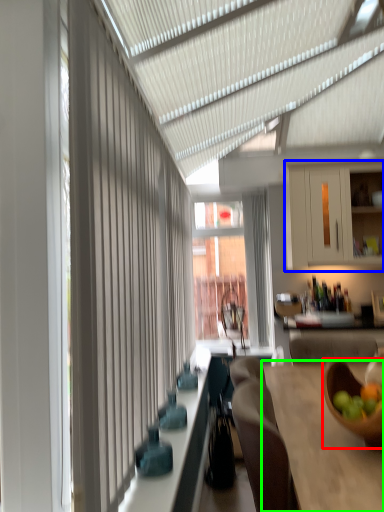
Question: Considering the real-world distances, which object is closest to bowl (highlighted by a red box)? cabinetry (highlighted by a blue box) or table (highlighted by a green box).

Choices:
 (A) cabinetry
 (B) table

Answer: (B)